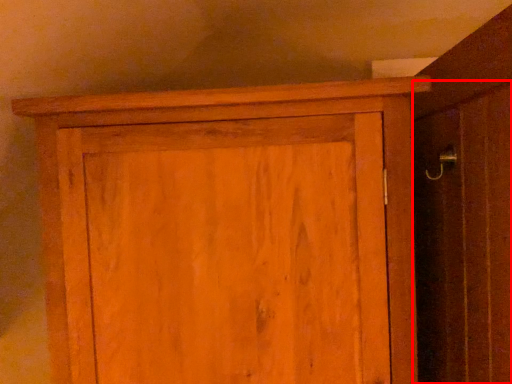
Question: From the image's perspective, what is the correct spatial relationship of screen door (annotated by the red box) in relation to cupboard?

Choices:
 (A) below
 (B) above

Answer: (B)